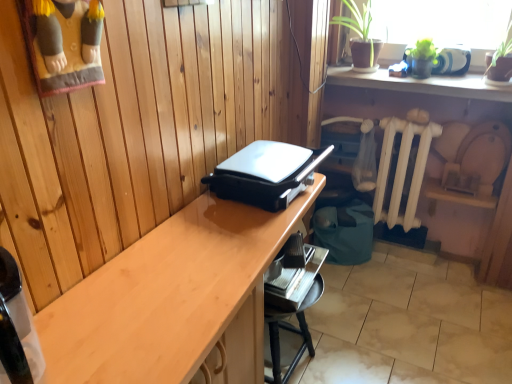
Locate an element on the screen. This screenshot has width=512, height=384. vacant point above light wood desk at center (from a real-world perspective) is located at coordinates (200, 262).